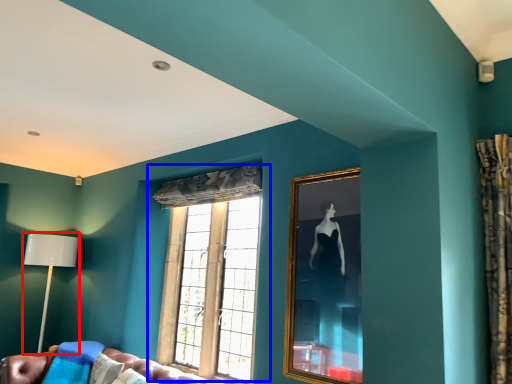
Question: Among these objects, which one is nearest to the camera, table lamp (highlighted by a red box) or window (highlighted by a blue box)?

Choices:
 (A) table lamp
 (B) window

Answer: (B)